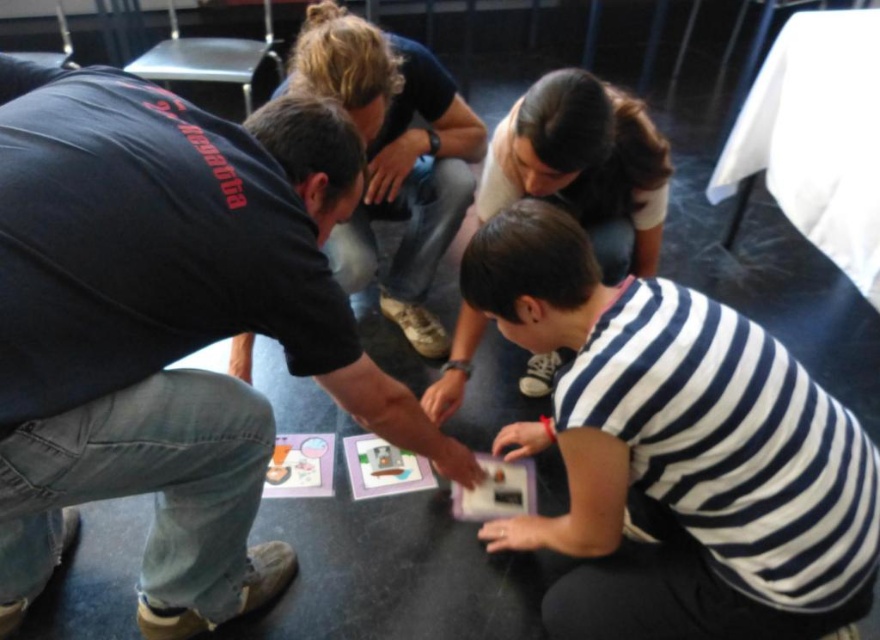
Question: Estimate the real-world distances between objects in this image. Which object is closer to the dark blue jeans at center?

Choices:
 (A) white matte card at lower center
 (B) striped fabric shirt at lower center

Answer: (B)

Question: Observing the image, what is the correct spatial positioning of striped fabric shirt at lower center in reference to white matte card at lower center?

Choices:
 (A) below
 (B) above

Answer: (B)

Question: Is white striped shirt at lower center to the left of dark blue jeans at center from the viewer's perspective?

Choices:
 (A) yes
 (B) no

Answer: (B)

Question: Which object is the farthest from the dark blue jeans at center?

Choices:
 (A) white striped shirt at lower center
 (B) white matte card at lower center
 (C) striped fabric shirt at lower center
 (D) black cotton shirt at center

Answer: (B)

Question: From the image, what is the correct spatial relationship of striped fabric shirt at lower center in relation to white matte card at lower center?

Choices:
 (A) right
 (B) left

Answer: (A)

Question: Which point is closer to the camera?

Choices:
 (A) (559, 109)
 (B) (486, 504)
 (C) (151, 273)
 (D) (568, 435)

Answer: (C)